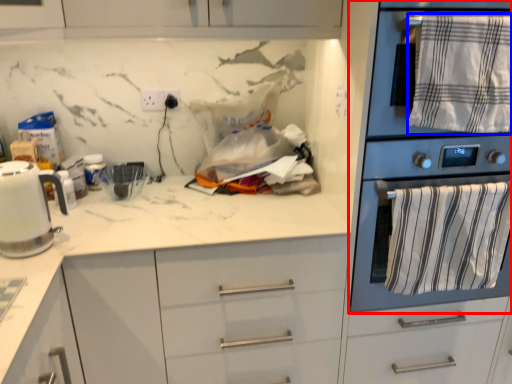
Question: Which object appears farthest to the camera in this image, home appliance (highlighted by a red box) or bath towel (highlighted by a blue box)?

Choices:
 (A) home appliance
 (B) bath towel

Answer: (B)